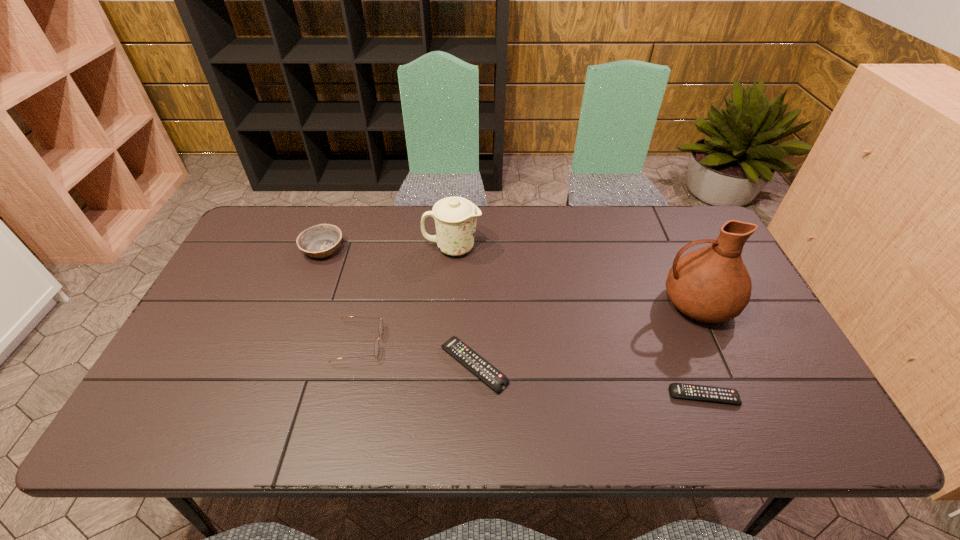
The image size is (960, 540). I want to click on the left remote control, so click(494, 378).

At what (x,y) coordinates should I click in order to perform the action: click on the taller remote control. Please return your answer as a coordinate pair (x, y). Image resolution: width=960 pixels, height=540 pixels. Looking at the image, I should click on (494, 378).

You are a GUI agent. You are given a task and a screenshot of the screen. Output one action in this format:
    pyautogui.click(x=<x>, y=<y>)
    Task: Click on the right remote control
    
    Given the screenshot: What is the action you would take?
    pyautogui.click(x=679, y=390)

Where is `the shorter remote control`? The image size is (960, 540). the shorter remote control is located at coordinates (679, 390).

Where is `the leftmost object`? This screenshot has height=540, width=960. the leftmost object is located at coordinates (320, 241).

Image resolution: width=960 pixels, height=540 pixels. In order to click on spectacles in this screenshot , I will do `click(376, 345)`.

The height and width of the screenshot is (540, 960). In order to click on chinaware in this screenshot , I will do pos(455,218).

The width and height of the screenshot is (960, 540). I want to click on pitcher, so click(711, 284).

You are a GUI agent. You are given a task and a screenshot of the screen. Output one action in this format:
    pyautogui.click(x=<x>, y=<y>)
    Task: Click on the vacant space situated 0.330m on the right of the fifth tallest object
    The image size is (960, 540).
    Given the screenshot: What is the action you would take?
    pyautogui.click(x=641, y=366)

The height and width of the screenshot is (540, 960). Identify the location of vacant area located on the back of the shortest object. (664, 296).